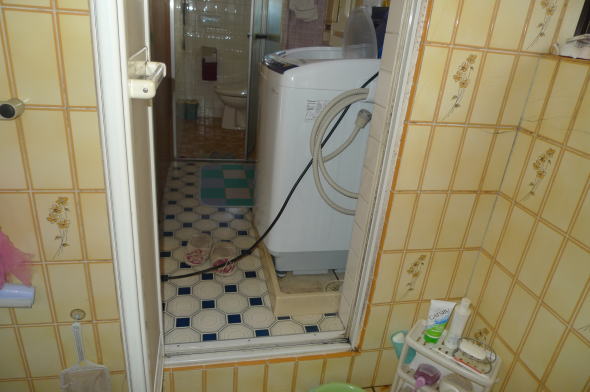
You are a GUI agent. You are given a task and a screenshot of the screen. Output one action in this format:
    pyautogui.click(x=<x>, y=<y>)
    Task: Click on the door
    
    Given the screenshot: What is the action you would take?
    pyautogui.click(x=123, y=172)